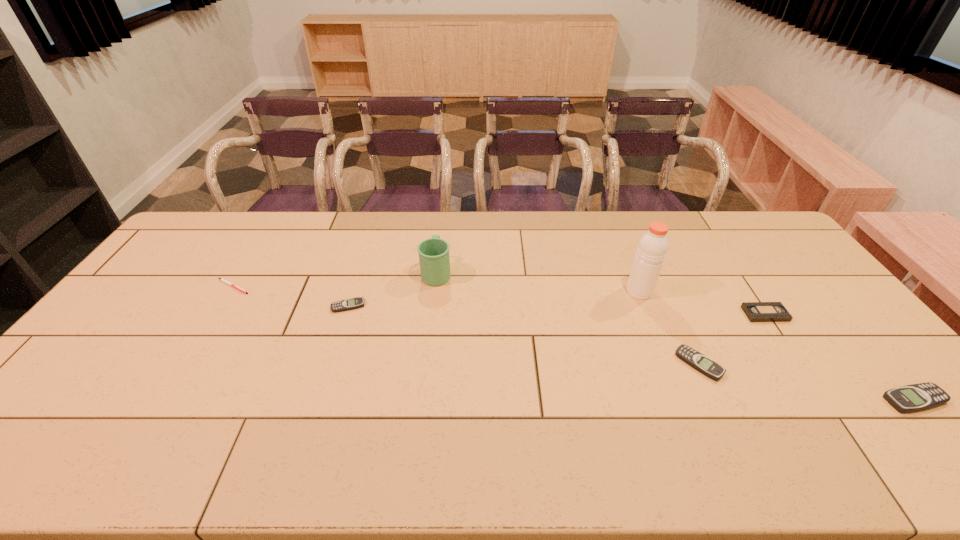
The height and width of the screenshot is (540, 960). In order to click on vacant space located on the back of the tallest object in this screenshot , I will do `click(613, 226)`.

Where is `object that is at the near edge`? object that is at the near edge is located at coordinates (916, 397).

Find the location of `object positioned at the right edge`. object positioned at the right edge is located at coordinates (916, 397).

Identify the location of object located in the near right corner section of the desktop. [916, 397].

Identify the location of free region at the far edge of the desktop. tap(583, 241).

Where is `vacant area at the near edge`? vacant area at the near edge is located at coordinates (521, 423).

Locate an element on the screen. vacant area at the left edge of the desktop is located at coordinates (185, 282).

Locate an element on the screen. The image size is (960, 540). vacant space at the right edge of the desktop is located at coordinates (884, 379).

Image resolution: width=960 pixels, height=540 pixels. In the image, there is a desktop. What are the coordinates of `vacant space at the far right corner` in the screenshot? It's located at (739, 214).

You are a GUI agent. You are given a task and a screenshot of the screen. Output one action in this format:
    pyautogui.click(x=<x>, y=<y>)
    Task: Click on the free spot between the leftmost beeper and the pen
    This screenshot has height=540, width=960.
    Given the screenshot: What is the action you would take?
    coord(291,296)